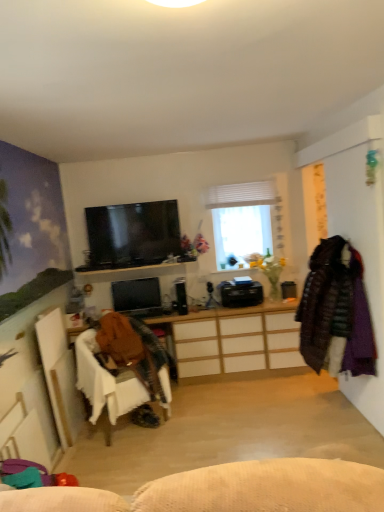
Locate an element on the screen. This screenshot has width=384, height=512. black glossy tv at upper center, positioned as the first television in front-to-back order is located at coordinates (132, 234).

Locate an element on the screen. This screenshot has width=384, height=512. white fabric chair at lower left is located at coordinates (106, 385).

What are the coordinates of `white matte window at center` in the screenshot? It's located at (247, 222).

Image resolution: width=384 pixels, height=512 pixels. What do you see at coordinates (234, 342) in the screenshot?
I see `wooden desk at center` at bounding box center [234, 342].

Locate an element on the screen. The height and width of the screenshot is (512, 384). black glossy tv at upper center, positioned as the second television in back-to-front order is located at coordinates (132, 234).

Locate an element on the screen. The width and height of the screenshot is (384, 512). window that is above the white fabric chair at lower left (from the image's perspective) is located at coordinates (247, 222).

In the scene shown: Can you tell me how much white matte window at center and white fabric chair at lower left differ in facing direction?

36.9 degrees.

Between white matte window at center and white fabric chair at lower left, which one is positioned behind?

white matte window at center is further away from the camera.

Based on the photo, can you confirm if velvet purple coat at right is wider than black glossy tv at upper center, positioned as the first television in front-to-back order?

Indeed, velvet purple coat at right has a greater width compared to black glossy tv at upper center, positioned as the first television in front-to-back order.

From a real-world perspective, is velvet purple coat at right positioned under black glossy tv at upper center, positioned as the first television in front-to-back order, based on gravity?

Yes, from a real-world perspective, velvet purple coat at right is under black glossy tv at upper center, positioned as the first television in front-to-back order.

Is velvet purple coat at right next to black glossy tv at upper center, positioned as the first television in front-to-back order?

velvet purple coat at right and black glossy tv at upper center, positioned as the first television in front-to-back order, are not in contact.

Does velvet purple coat at right have a greater height compared to black glossy tv at upper center, positioned as the second television in back-to-front order?

Yes.

Does dark brown quilted coat at right, the second clothing when ordered from left to right, come behind wooden desk at center?

No, dark brown quilted coat at right, the second clothing when ordered from left to right, is closer to the camera.

Considering the relative positions of dark brown quilted coat at right, marked as the first clothing in a right-to-left arrangement, and wooden desk at center in the image provided, is dark brown quilted coat at right, marked as the first clothing in a right-to-left arrangement, to the left of wooden desk at center from the viewer's perspective?

In fact, dark brown quilted coat at right, marked as the first clothing in a right-to-left arrangement, is to the right of wooden desk at center.

Which is further, (x=363, y=317) or (x=188, y=332)?

The point (x=188, y=332) is farther.

From the image's perspective, is dark brown quilted coat at right, marked as the first clothing in a right-to-left arrangement, positioned above or below wooden desk at center?

Based on their image positions, dark brown quilted coat at right, marked as the first clothing in a right-to-left arrangement, is located above wooden desk at center.

Looking at this image, can you confirm if brown leather jacket at lower left, the second clothing viewed from the right, is bigger than white fabric chair at lower left?

Actually, brown leather jacket at lower left, the second clothing viewed from the right, might be smaller than white fabric chair at lower left.

From the image's perspective, is brown leather jacket at lower left, the second clothing viewed from the right, located above white fabric chair at lower left?

Correct, brown leather jacket at lower left, the second clothing viewed from the right, appears higher than white fabric chair at lower left in the image.

Considering the positions of objects brown leather jacket at lower left, the second clothing viewed from the right, and white fabric chair at lower left in the image provided, who is more to the left, brown leather jacket at lower left, the second clothing viewed from the right, or white fabric chair at lower left?

Positioned to the left is white fabric chair at lower left.

Does brown leather jacket at lower left, which ranks as the first clothing in left-to-right order, turn towards white fabric chair at lower left?

Yes, brown leather jacket at lower left, which ranks as the first clothing in left-to-right order, is turned towards white fabric chair at lower left.

From the picture: Is black glossy tv at upper center, the second television in the bottom-to-top sequence, surrounding wooden desk at center?

Actually, wooden desk at center is outside black glossy tv at upper center, the second television in the bottom-to-top sequence.

Between black glossy tv at upper center, the 1th television in the top-to-bottom sequence, and wooden desk at center, which one has smaller size?

With smaller size is black glossy tv at upper center, the 1th television in the top-to-bottom sequence.

From the image's perspective, which one is positioned lower, black glossy tv at upper center, positioned as the first television in front-to-back order, or wooden desk at center?

wooden desk at center is shown below in the image.

Is dark brown quilted coat at right, the second clothing when ordered from left to right, situated inside white fabric chair at lower left or outside?

dark brown quilted coat at right, the second clothing when ordered from left to right, cannot be found inside white fabric chair at lower left.

From the image's perspective, which one is positioned higher, dark brown quilted coat at right, marked as the first clothing in a right-to-left arrangement, or white fabric chair at lower left?

dark brown quilted coat at right, marked as the first clothing in a right-to-left arrangement, from the image's perspective.

Are dark brown quilted coat at right, marked as the first clothing in a right-to-left arrangement, and white fabric chair at lower left far apart?

Indeed, dark brown quilted coat at right, marked as the first clothing in a right-to-left arrangement, is not near white fabric chair at lower left.

Which object is further away from the camera, dark brown quilted coat at right, the second clothing when ordered from left to right, or white fabric chair at lower left?

Positioned behind is white fabric chair at lower left.

From a real-world perspective, between wooden desk at center and white fabric chair at lower left, who is vertically higher?

From a 3D spatial view, white fabric chair at lower left is above.

Is wooden desk at center not close to white fabric chair at lower left?

No.

How different are the orientations of wooden desk at center and white fabric chair at lower left in degrees?

wooden desk at center and white fabric chair at lower left are facing 35.9 degrees away from each other.

The image size is (384, 512). I want to click on window located behind the white fabric chair at lower left, so click(x=247, y=222).

This screenshot has height=512, width=384. In order to click on side in front of the black glossy tv at upper center, the 1th television in the top-to-bottom sequence in this screenshot , I will do `click(358, 233)`.

Looking at the image, which one is located further to matte black monitor at center, positioned as the first television in bottom-to-top order, dark brown quilted coat at right, marked as the first clothing in a right-to-left arrangement, or white matte window at center?

Among the two, dark brown quilted coat at right, marked as the first clothing in a right-to-left arrangement, is located further to matte black monitor at center, positioned as the first television in bottom-to-top order.

Considering their positions, is velvet purple coat at right positioned closer to brown leather jacket at lower left, which ranks as the first clothing in left-to-right order, than white matte window at center?

The object closer to brown leather jacket at lower left, which ranks as the first clothing in left-to-right order, is white matte window at center.

From the image, which object appears to be farther from brown leather jacket at lower left, the second clothing viewed from the right, white fabric chair at lower left or white matte window at center?

white matte window at center is further to brown leather jacket at lower left, the second clothing viewed from the right.

Considering their positions, is matte black monitor at center, the 1th television viewed from the back, positioned further to white fabric chair at lower left than velvet purple coat at right?

velvet purple coat at right.

Looking at the image, which one is located further to brown leather jacket at lower left, the second clothing viewed from the right, velvet purple coat at right or black glossy tv at upper center, the 1th television in the top-to-bottom sequence?

velvet purple coat at right.

Looking at the image, which one is located closer to white fabric chair at lower left, dark brown quilted coat at right, marked as the first clothing in a right-to-left arrangement, or wooden desk at center?

Based on the image, wooden desk at center appears to be nearer to white fabric chair at lower left.

From the image, which object appears to be farther from velvet purple coat at right, matte black monitor at center, which is counted as the 2th television, starting from the front, or brown leather jacket at lower left, which ranks as the first clothing in left-to-right order?

matte black monitor at center, which is counted as the 2th television, starting from the front, lies further to velvet purple coat at right than the other object.

Based on their spatial positions, is wooden desk at center or dark brown quilted coat at right, marked as the first clothing in a right-to-left arrangement, further from black glossy tv at upper center, the second television in the bottom-to-top sequence?

dark brown quilted coat at right, marked as the first clothing in a right-to-left arrangement, is further to black glossy tv at upper center, the second television in the bottom-to-top sequence.

The image size is (384, 512). I want to click on clothing between black glossy tv at upper center, positioned as the second television in back-to-front order, and dark brown quilted coat at right, marked as the first clothing in a right-to-left arrangement, from left to right, so click(x=132, y=350).

In order to click on television located between black glossy tv at upper center, positioned as the second television in back-to-front order, and velvet purple coat at right in the left-right direction in this screenshot , I will do `click(137, 297)`.

I want to click on cabinetry situated between brown leather jacket at lower left, which ranks as the first clothing in left-to-right order, and velvet purple coat at right from left to right, so click(234, 342).

The height and width of the screenshot is (512, 384). What are the coordinates of `television located between white fabric chair at lower left and matte black monitor at center, which is counted as the 2th television, starting from the front, in the depth direction` in the screenshot? It's located at (132, 234).